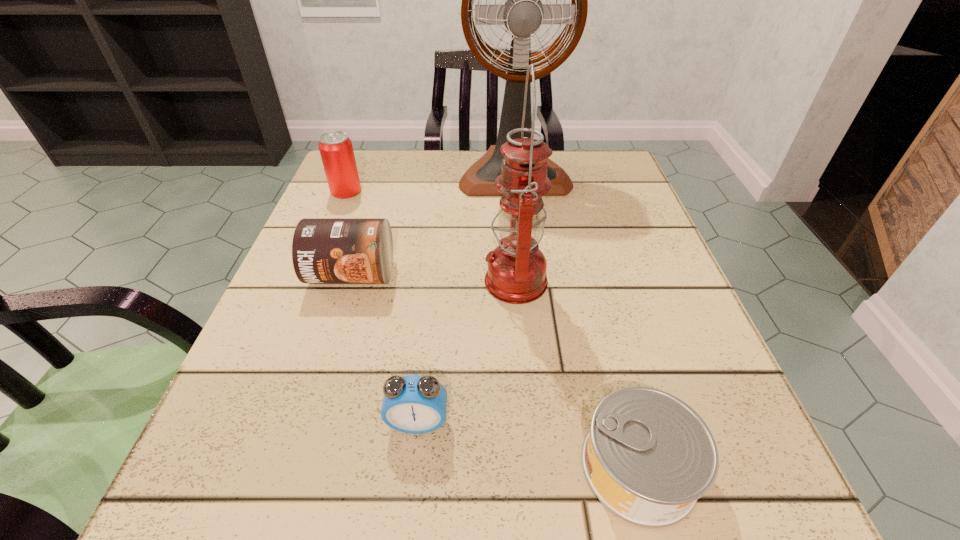
Where is `fan`? This screenshot has height=540, width=960. fan is located at coordinates (523, 13).

I want to click on oil lamp, so click(x=516, y=274).

What are the coordinates of `the farthest can` in the screenshot? It's located at (336, 150).

Locate an element on the screen. The height and width of the screenshot is (540, 960). the tallest can is located at coordinates (336, 150).

Image resolution: width=960 pixels, height=540 pixels. Find the location of `the third shortest object`. the third shortest object is located at coordinates (324, 250).

You are a GUI agent. You are given a task and a screenshot of the screen. Output one action in this format:
    pyautogui.click(x=<x>, y=<y>)
    Task: Click on the second nearest can
    This screenshot has width=960, height=540.
    Given the screenshot: What is the action you would take?
    pyautogui.click(x=324, y=250)

Find the location of a particular element. The image size is (960, 540). alarm clock is located at coordinates (414, 404).

Locate an element on the screen. This screenshot has width=960, height=540. the shortest object is located at coordinates (648, 457).

Identify the location of the rightmost can. (648, 457).

Image resolution: width=960 pixels, height=540 pixels. Identify the location of vacant position located 0.270m on the front-facing side of the tallest object. (526, 282).